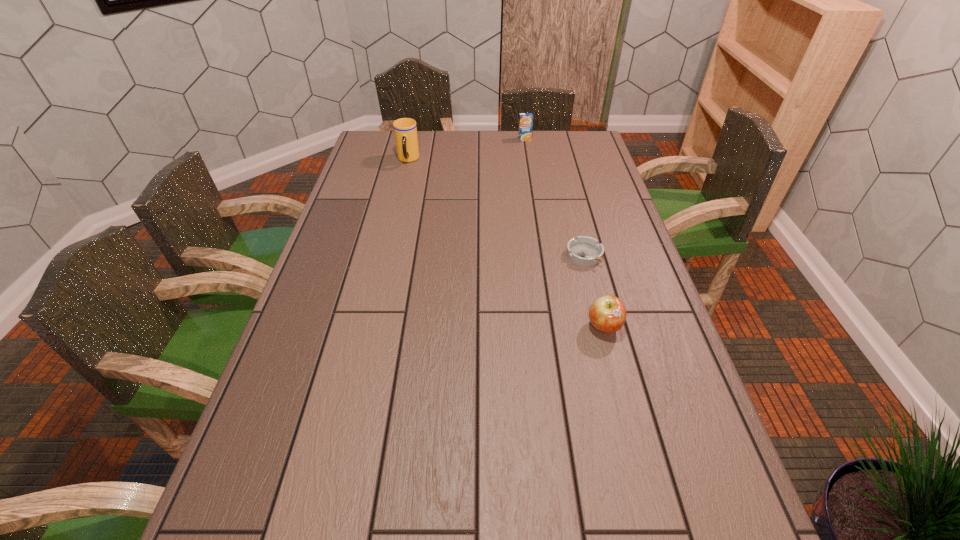
Locate an element on the screen. This screenshot has width=960, height=540. vacant space at the right edge of the desktop is located at coordinates (618, 258).

In the image, there is a desktop. What are the coordinates of `vacant space at the far left corner` in the screenshot? It's located at (376, 151).

The image size is (960, 540). In order to click on vacant region at the far right corner of the desktop in this screenshot , I will do `click(565, 151)`.

Identify the location of vacant area that lies between the third nearest object and the apple. (506, 243).

Identify the location of free space between the apple and the second tallest object. Image resolution: width=960 pixels, height=540 pixels. (564, 233).

At what (x,y) coordinates should I click in order to perform the action: click on free point between the second tallest object and the leftmost object. Please return your answer as a coordinate pair (x, y). The height and width of the screenshot is (540, 960). Looking at the image, I should click on (467, 150).

Point out which object is positioned as the third nearest to the orange_juice. Please provide its 2D coordinates. Your answer should be formatted as a tuple, i.e. [(x, y)], where the tuple contains the x and y coordinates of a point satisfying the conditions above.

[(607, 314)]

Where is `the second closest object to the third farthest object`? The image size is (960, 540). the second closest object to the third farthest object is located at coordinates (525, 119).

This screenshot has height=540, width=960. I want to click on free space in the image that satisfies the following two spatial constraints: 1. on the front side of the orange_juice; 2. on the right side of the second nearest object, so click(x=542, y=255).

At what (x,y) coordinates should I click in order to perform the action: click on free location that satisfies the following two spatial constraints: 1. on the side of the third farthest object with the handle; 2. on the right side of the second farthest object. Please return your answer as a coordinate pair (x, y). Looking at the image, I should click on (386, 255).